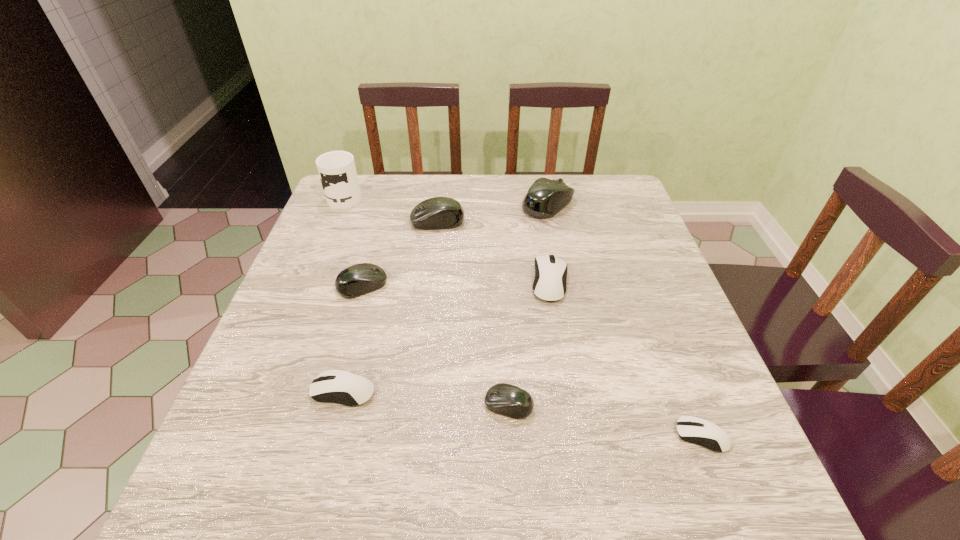
What are the coordinates of `free space at the right edge of the desktop` in the screenshot? It's located at (632, 251).

In the image, there is a desktop. Identify the location of vacant space at the far right corner. The height and width of the screenshot is (540, 960). (624, 179).

I want to click on vacant space at the near right corner of the desktop, so click(698, 470).

I want to click on vacant point located between the rightmost white mouse and the leftmost black mouse, so click(x=532, y=361).

Locate an element on the screen. Image resolution: width=960 pixels, height=540 pixels. vacant point located between the fourth object from left to right and the leftmost black mouse is located at coordinates (400, 253).

Identify the location of empty space that is in between the leftmost white mouse and the fifth mouse from right to left. (391, 306).

Find the location of `free space between the biggest black mouse and the leftmost black mouse`. free space between the biggest black mouse and the leftmost black mouse is located at coordinates (455, 245).

Where is `blank region between the tallest mouse and the second black mouse from right to left`? Image resolution: width=960 pixels, height=540 pixels. blank region between the tallest mouse and the second black mouse from right to left is located at coordinates [528, 305].

Find the location of a particular element. vacant space that is in between the second biggest white mouse and the leftmost black mouse is located at coordinates (353, 338).

I want to click on vacant area that lies between the farthest white mouse and the biggest black mouse, so click(x=549, y=243).